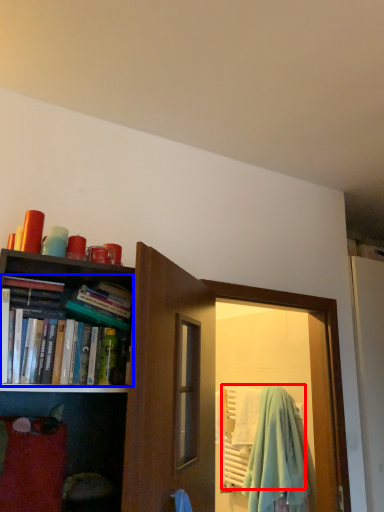
Question: Which of the following is the farthest to the observer, beach towel (highlighted by a red box) or book (highlighted by a blue box)?

Choices:
 (A) beach towel
 (B) book

Answer: (A)